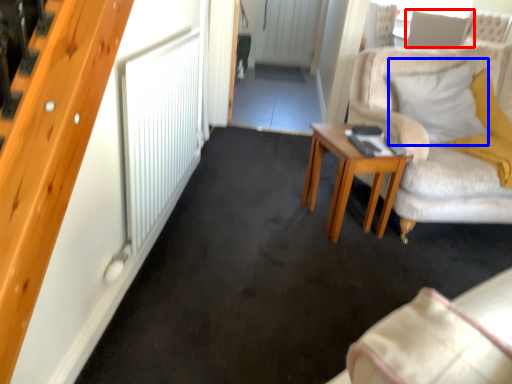
Question: Which object is further to the camera taking this photo, pillow (highlighted by a red box) or pillow (highlighted by a blue box)?

Choices:
 (A) pillow
 (B) pillow

Answer: (A)